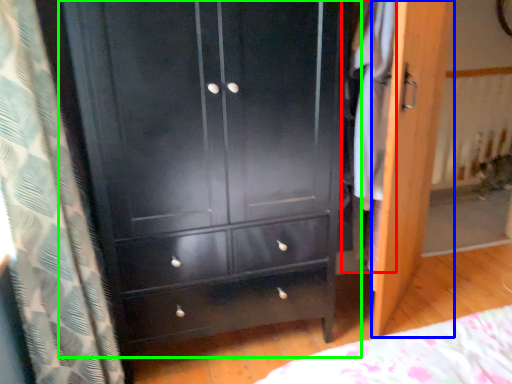
Question: Estimate the real-world distances between objects in this image. Which object is farther from clothing (highlighted by a red box), screen door (highlighted by a blue box) or chest of drawers (highlighted by a green box)?

Choices:
 (A) screen door
 (B) chest of drawers

Answer: (B)